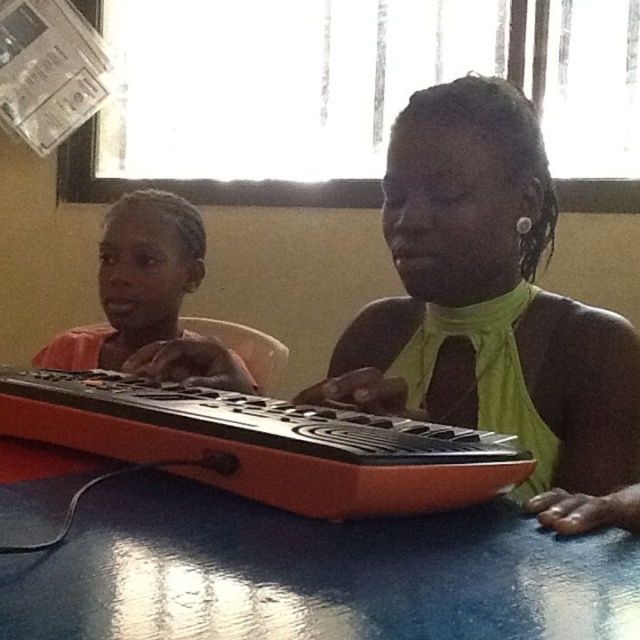
Does blue glossy table at lower center have a lesser height compared to orange matte keyboard at center?

Indeed, blue glossy table at lower center has a lesser height compared to orange matte keyboard at center.

Locate an element on the screen. This screenshot has height=640, width=640. blue glossy table at lower center is located at coordinates (310, 573).

Is point (413, 634) farther from viewer compared to point (496, 353)?

No, (413, 634) is closer to viewer.

The image size is (640, 640). Find the location of `blue glossy table at lower center`. blue glossy table at lower center is located at coordinates (310, 573).

Consider the image. Which of these two, blue glossy table at lower center or orange matte keyboard at left, stands shorter?

blue glossy table at lower center

Who is positioned more to the right, blue glossy table at lower center or orange matte keyboard at left?

From the viewer's perspective, blue glossy table at lower center appears more on the right side.

Is point (195, 598) positioned behind point (138, 198)?

No, it is in front of (138, 198).

This screenshot has width=640, height=640. Identify the location of blue glossy table at lower center. (310, 573).

Looking at this image, which is above, orange matte keyboard at center or orange matte keyboard at left?

orange matte keyboard at left is above.

Between point (474, 243) and point (140, 320), which one is positioned behind?

The point (140, 320) is behind.

This screenshot has height=640, width=640. Find the location of `orange matte keyboard at center`. orange matte keyboard at center is located at coordinates (493, 308).